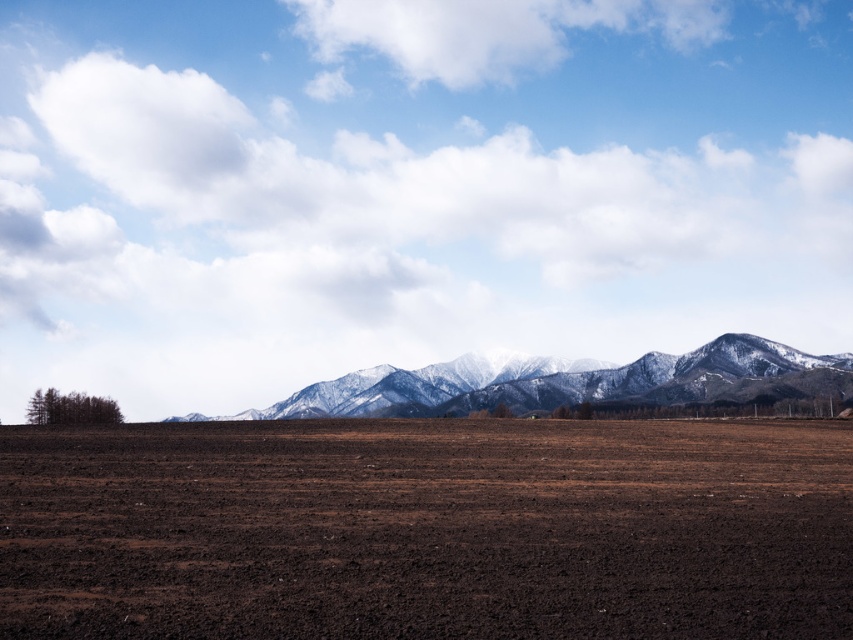
You are standing at the point marked by the coordinates point (427, 529) in the image. Based on the scene described, what type of terrain are you currently standing on?

You are standing on brown soil at center, which is part of the recently plowed field in the foreground of the scene.